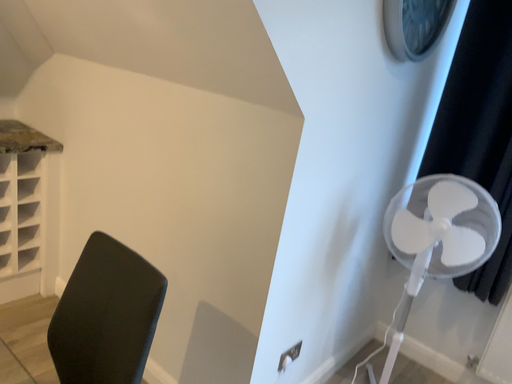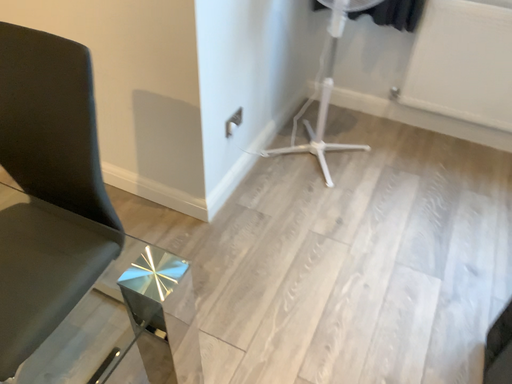
Question: How did the camera likely rotate when shooting the video?

Choices:
 (A) rotated left
 (B) rotated right

Answer: (B)